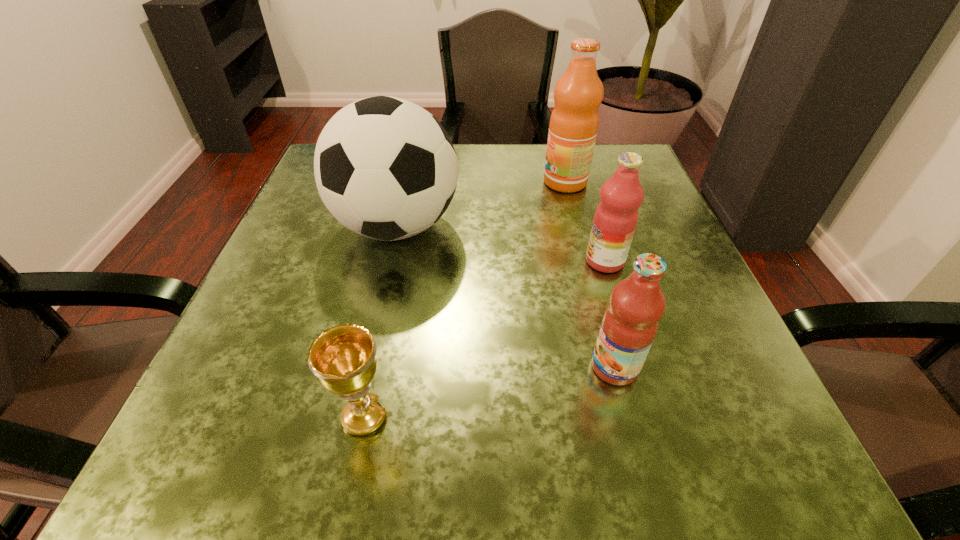
I want to click on vacant point located between the fourth shortest object and the chalice, so click(x=381, y=321).

Locate an element on the screen. The height and width of the screenshot is (540, 960). blank region between the second tallest object and the second nearest object is located at coordinates (506, 296).

Locate an element on the screen. The height and width of the screenshot is (540, 960). unoccupied area between the farthest fruit juice and the second nearest object is located at coordinates (590, 274).

I want to click on vacant space that is in between the tallest fruit juice and the nearest fruit juice, so click(590, 274).

This screenshot has width=960, height=540. What are the coordinates of `empty space that is in between the chalice and the nearest fruit juice` in the screenshot? It's located at (490, 392).

You are a GUI agent. You are given a task and a screenshot of the screen. Output one action in this format:
    pyautogui.click(x=<x>, y=<y>)
    Task: Click on the empty space that is in between the shortest object and the farthest fruit juice
    This screenshot has width=960, height=540.
    Given the screenshot: What is the action you would take?
    coord(465,299)

Where is `object identified as the third closest to the nearest object`? object identified as the third closest to the nearest object is located at coordinates (616, 216).

The height and width of the screenshot is (540, 960). What are the coordinates of `object that can be found as the third closest to the nearest object` in the screenshot? It's located at (616, 216).

I want to click on fruit juice that is the second closest one to the second nearest object, so click(574, 121).

This screenshot has width=960, height=540. I want to click on fruit juice that stands as the closest to the second nearest fruit juice, so click(630, 323).